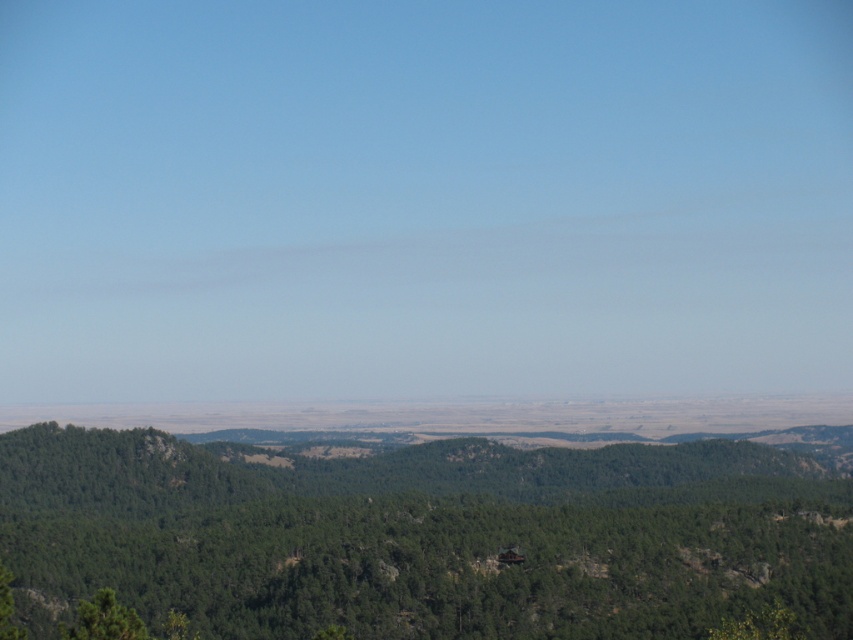
Question: Does green leafy tree at center lie in front of green matte tree at lower left?

Choices:
 (A) no
 (B) yes

Answer: (A)

Question: In this image, where is green leafy tree at center located relative to green matte tree at lower left?

Choices:
 (A) below
 (B) above

Answer: (A)

Question: Which of the following is the closest to the observer?

Choices:
 (A) green leafy tree at center
 (B) green matte tree at lower left

Answer: (B)

Question: Does green leafy tree at center have a lesser width compared to green matte tree at lower left?

Choices:
 (A) yes
 (B) no

Answer: (B)